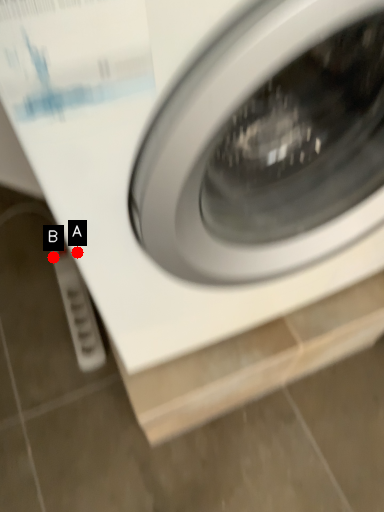
Question: Two points are circled on the image, labeled by A and B beside each circle. Among these points, which one is nearest to the camera?

Choices:
 (A) A is closer
 (B) B is closer

Answer: (A)